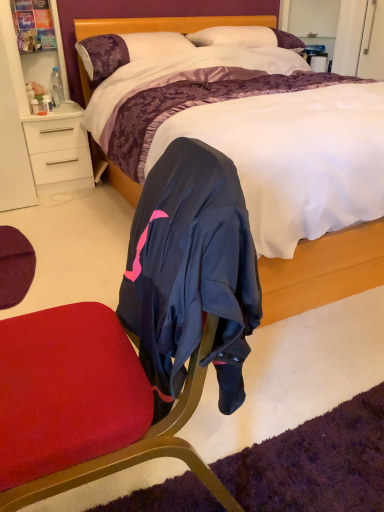
Question: From the image's perspective, is white soft pillow at upper center, acting as the 2th pillow starting from the left, located above purple satin pillow at upper left, the 1th pillow when ordered from left to right?

Choices:
 (A) yes
 (B) no

Answer: (A)

Question: Is white soft pillow at upper center, acting as the 2th pillow starting from the left, to the right of purple satin pillow at upper left, the 1th pillow when ordered from left to right, from the viewer's perspective?

Choices:
 (A) yes
 (B) no

Answer: (A)

Question: Is white soft pillow at upper center, acting as the 2th pillow starting from the left, next to purple satin pillow at upper left, placed as the second pillow when sorted from right to left?

Choices:
 (A) no
 (B) yes

Answer: (A)

Question: Does white soft pillow at upper center, acting as the 2th pillow starting from the left, have a larger size compared to purple satin pillow at upper left, placed as the second pillow when sorted from right to left?

Choices:
 (A) yes
 (B) no

Answer: (B)

Question: Is white soft pillow at upper center, acting as the 1th pillow starting from the right, smaller than purple satin pillow at upper left, placed as the second pillow when sorted from right to left?

Choices:
 (A) no
 (B) yes

Answer: (B)

Question: Do you think white glossy drawer at left is within satin purple bed at center, or outside of it?

Choices:
 (A) outside
 (B) inside

Answer: (A)

Question: In terms of height, does white glossy drawer at left look taller or shorter compared to satin purple bed at center?

Choices:
 (A) tall
 (B) short

Answer: (B)

Question: Is point (29, 151) positioned closer to the camera than point (334, 243)?

Choices:
 (A) closer
 (B) farther

Answer: (B)

Question: From a real-world perspective, is white glossy drawer at left physically located above or below satin purple bed at center?

Choices:
 (A) below
 (B) above

Answer: (A)

Question: Is white glossy drawer at left inside the boundaries of purple satin pillow at upper left, the 1th pillow when ordered from left to right, or outside?

Choices:
 (A) inside
 (B) outside

Answer: (B)

Question: Considering the positions of white glossy drawer at left and purple satin pillow at upper left, placed as the second pillow when sorted from right to left, in the image, is white glossy drawer at left bigger or smaller than purple satin pillow at upper left, placed as the second pillow when sorted from right to left,?

Choices:
 (A) small
 (B) big

Answer: (B)

Question: Relative to purple satin pillow at upper left, placed as the second pillow when sorted from right to left, is white glossy drawer at left in front or behind?

Choices:
 (A) behind
 (B) front

Answer: (A)

Question: Is white glossy drawer at left taller or shorter than purple satin pillow at upper left, placed as the second pillow when sorted from right to left?

Choices:
 (A) short
 (B) tall

Answer: (B)

Question: Is clear plastic bottle at left inside or outside of purple satin pillow at upper left, placed as the second pillow when sorted from right to left?

Choices:
 (A) inside
 (B) outside

Answer: (B)

Question: Relative to purple satin pillow at upper left, placed as the second pillow when sorted from right to left, is clear plastic bottle at left in front or behind?

Choices:
 (A) front
 (B) behind

Answer: (B)